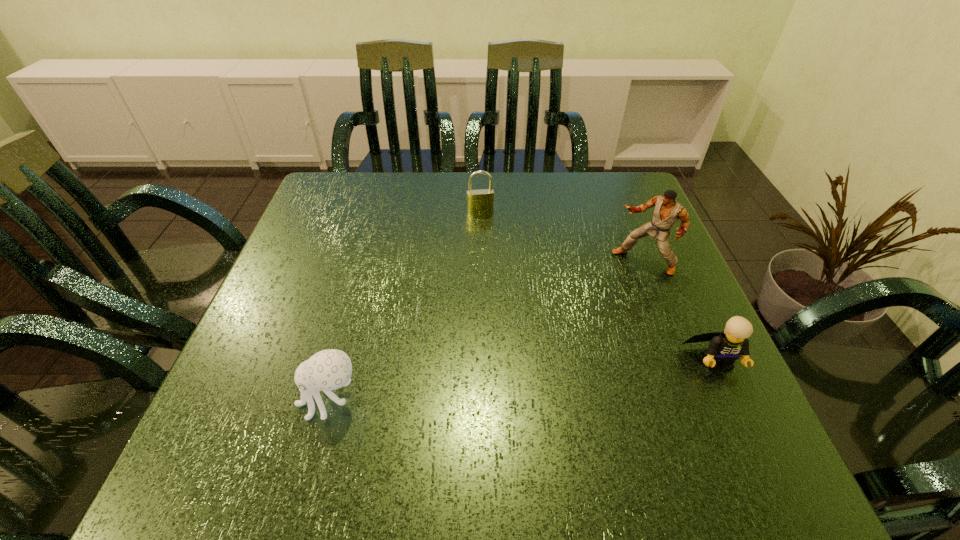
Find the location of a particular element. This screenshot has width=960, height=540. the leftmost object is located at coordinates (331, 369).

The width and height of the screenshot is (960, 540). Find the location of `Lego`. Lego is located at coordinates (725, 347).

What are the coordinates of `the farthest object` in the screenshot? It's located at (478, 201).

Find the location of `padlock`. padlock is located at coordinates (478, 201).

Identify the location of the second farthest object. This screenshot has height=540, width=960. (667, 211).

Find the location of `puncher`. puncher is located at coordinates (667, 211).

At what (x,y) coordinates should I click in order to perform the action: click on blank space located 0.090m on the front-facing side of the octopus. Please return your answer as a coordinate pair (x, y). Looking at the image, I should click on (247, 399).

Identify the location of free space located 0.070m on the front-facing side of the octopus. (258, 399).

What are the coordinates of `free space located 0.080m on the front-facing side of the octopus` in the screenshot? It's located at (252, 399).

The image size is (960, 540). Find the location of `free space located 0.280m on the front-facing side of the padlock`. free space located 0.280m on the front-facing side of the padlock is located at coordinates (492, 289).